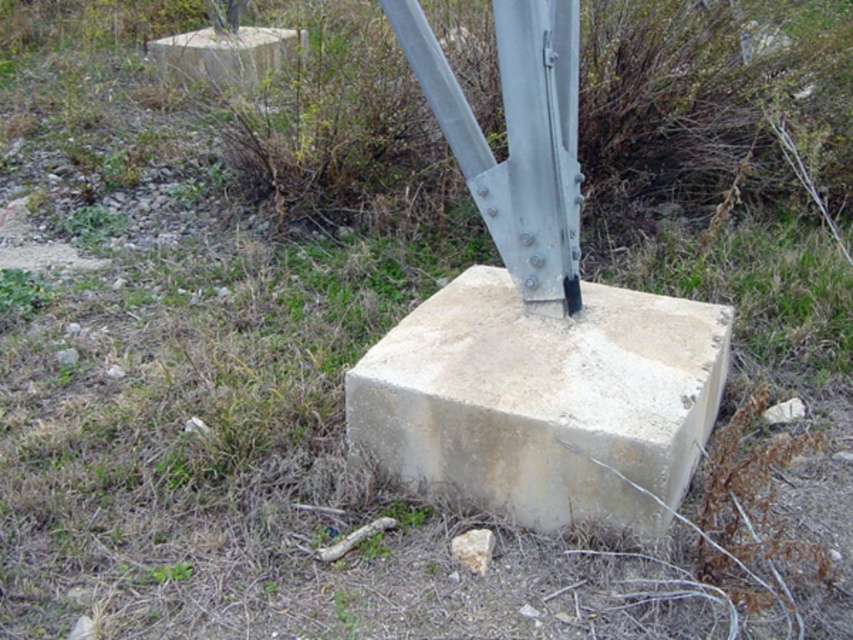
Question: Which object appears closest to the camera in this image?

Choices:
 (A) light gray concrete block at center
 (B) beige concrete block at upper left

Answer: (A)

Question: Which of the following is the farthest from the observer?

Choices:
 (A) beige concrete block at upper left
 (B) light gray concrete block at center

Answer: (A)

Question: Which point appears closest to the camera in this image?

Choices:
 (A) (648, 385)
 (B) (257, 44)

Answer: (A)

Question: Does light gray concrete block at center have a larger size compared to beige concrete block at upper left?

Choices:
 (A) no
 (B) yes

Answer: (A)

Question: Is light gray concrete block at center smaller than beige concrete block at upper left?

Choices:
 (A) no
 (B) yes

Answer: (B)

Question: Can you confirm if light gray concrete block at center is wider than beige concrete block at upper left?

Choices:
 (A) no
 (B) yes

Answer: (B)